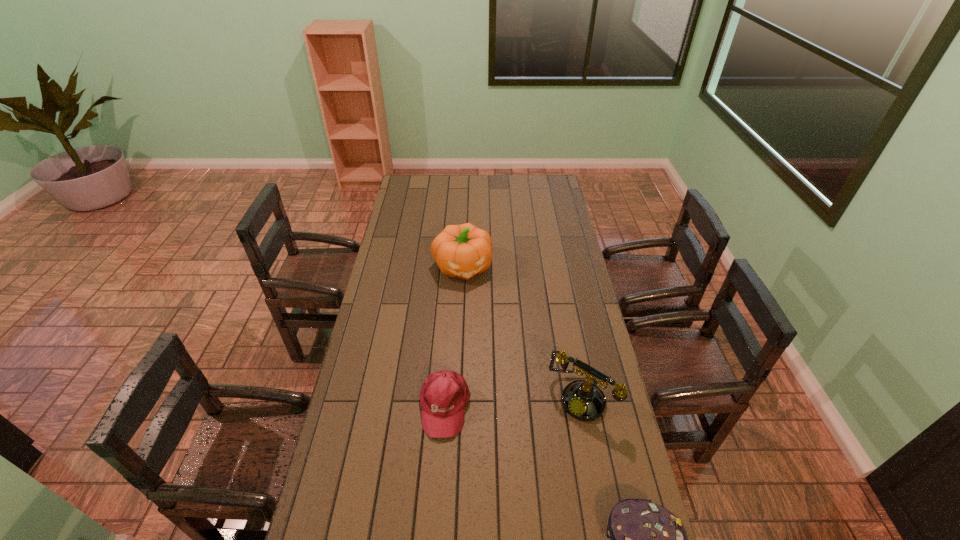
Where is `object at the right edge`? The height and width of the screenshot is (540, 960). object at the right edge is located at coordinates (584, 401).

In order to click on free space at the near edge of the desktop in this screenshot , I will do tap(400, 522).

Identify the location of vacant area at the left edge. The height and width of the screenshot is (540, 960). pyautogui.click(x=396, y=345).

In the image, there is a desktop. At what (x,y) coordinates should I click in order to perform the action: click on vacant space at the right edge. Please return your answer as a coordinate pair (x, y). The width and height of the screenshot is (960, 540). Looking at the image, I should click on (548, 274).

I want to click on free space at the far right corner, so click(538, 177).

At what (x,y) coordinates should I click in order to perform the action: click on free spot between the pumpkin and the baseball cap. Please return your answer as a coordinate pair (x, y). Looking at the image, I should click on click(x=453, y=336).

Identify the location of empty space between the pumpkin and the baseball cap. (453, 336).

What are the coordinates of `free area in between the baseball cap and the pumpkin` in the screenshot? It's located at (453, 336).

What are the coordinates of `free point between the baseball cap and the farthest object` in the screenshot? It's located at (453, 336).

I want to click on empty space that is in between the pumpkin and the telephone, so click(521, 332).